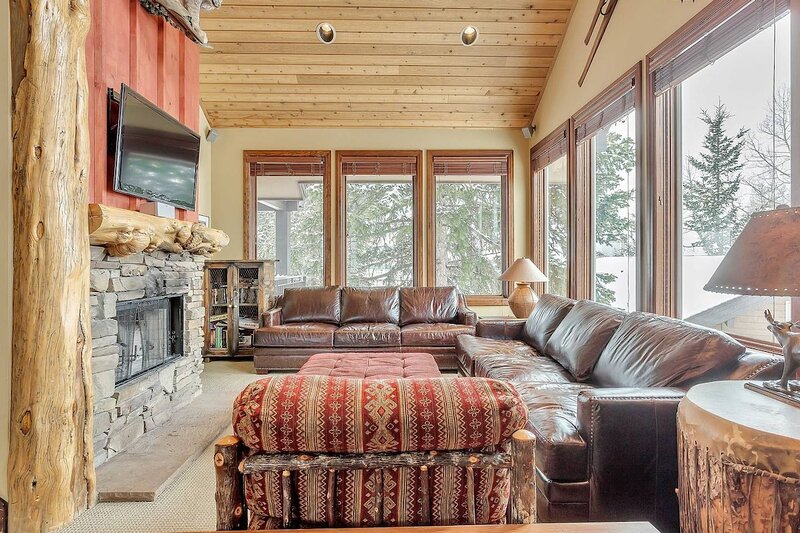
You are a GUI agent. You are given a task and a screenshot of the screen. Output one action in this format:
    pyautogui.click(x=<x>, y=<y>)
    Task: Click on the window
    The height and width of the screenshot is (533, 800).
    Given the screenshot: What is the action you would take?
    pyautogui.click(x=458, y=230)